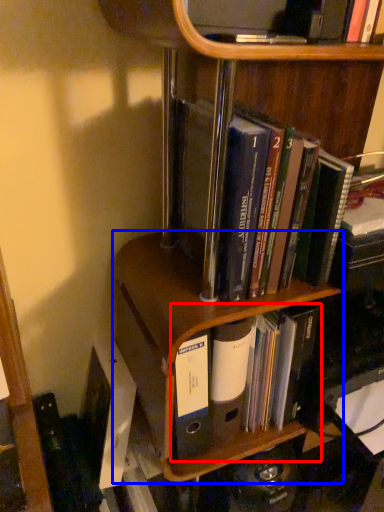
Question: Which object is closer to the camera taking this photo, book (highlighted by a red box) or shelf (highlighted by a blue box)?

Choices:
 (A) book
 (B) shelf

Answer: (B)